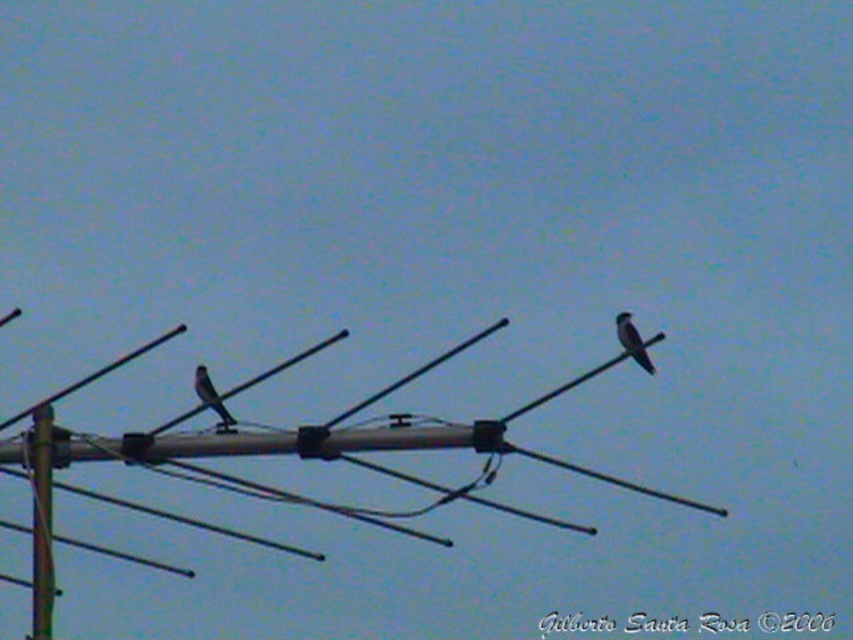
From the picture: Is dark gray feathers at upper right thinner than gray matte bird at left?

Indeed, dark gray feathers at upper right has a lesser width compared to gray matte bird at left.

Is point (618, 326) positioned after point (212, 401)?

Yes, point (618, 326) is farther from viewer.

Image resolution: width=853 pixels, height=640 pixels. Identify the location of dark gray feathers at upper right. (635, 340).